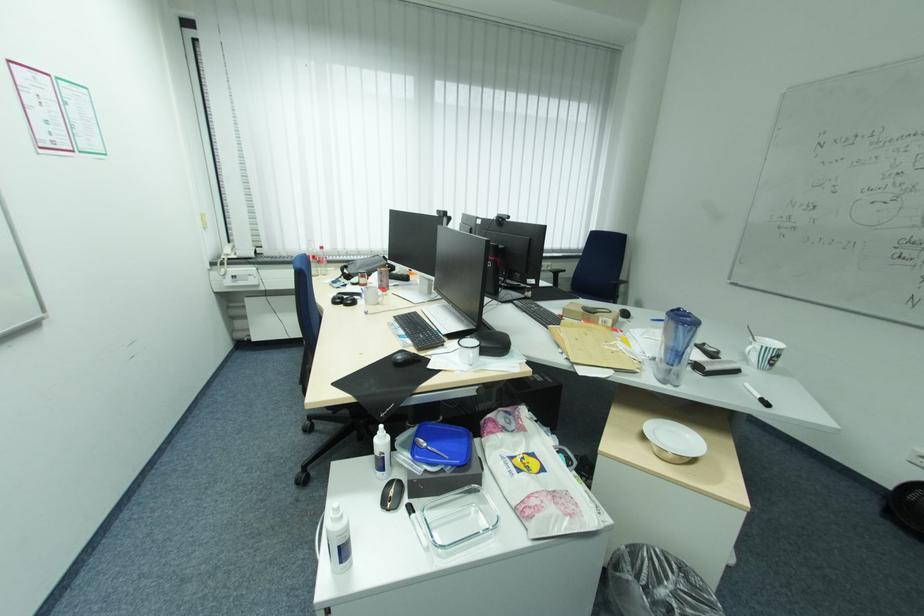
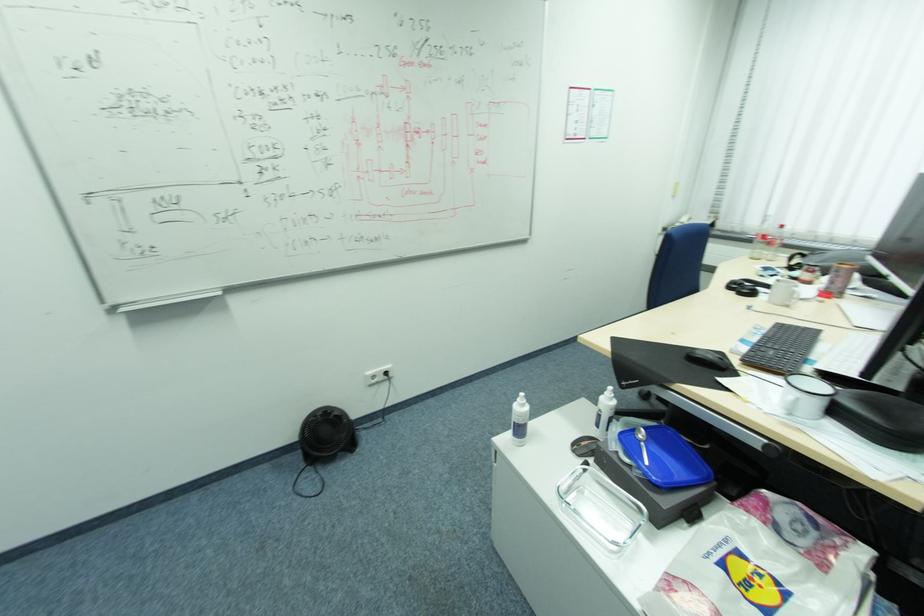
Locate, in the second image, the point that corresponds to (384,304) in the first image.

(792, 307)